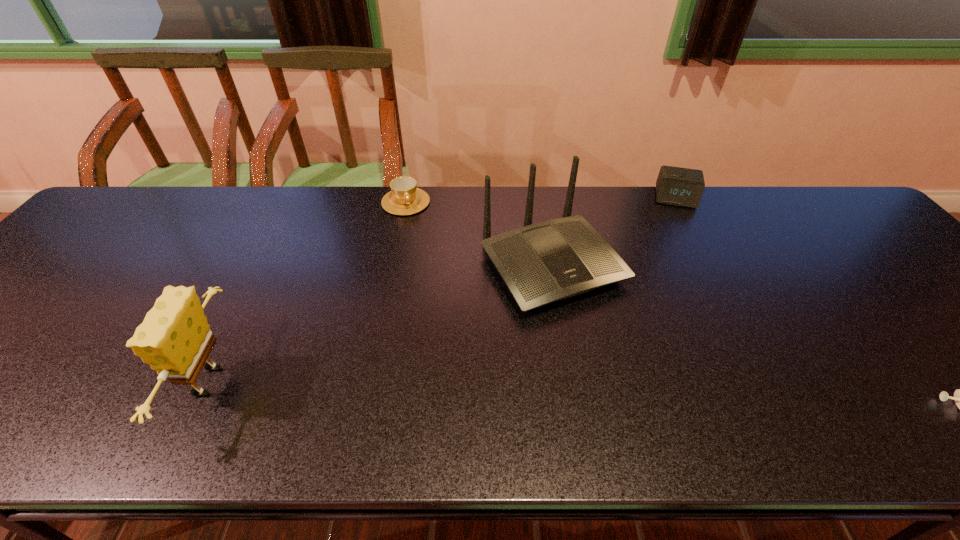
Locate an element on the screen. The height and width of the screenshot is (540, 960). free spot between the leftmost object and the router is located at coordinates (378, 323).

The width and height of the screenshot is (960, 540). In order to click on free area in between the cup and the fourth object from left to right in this screenshot , I will do `click(540, 200)`.

Find the location of a particular element. vacant point located between the sponge and the router is located at coordinates (378, 323).

You are a GUI agent. You are given a task and a screenshot of the screen. Output one action in this format:
    pyautogui.click(x=<x>, y=<y>)
    Task: Click on the vacant space that is in between the fourth object from left to right and the leftmost object
    
    Given the screenshot: What is the action you would take?
    pyautogui.click(x=440, y=290)

You are a GUI agent. You are given a task and a screenshot of the screen. Output one action in this format:
    pyautogui.click(x=<x>, y=<y>)
    Task: Click on the object that can be found as the second closest to the router
    The width and height of the screenshot is (960, 540).
    Given the screenshot: What is the action you would take?
    pyautogui.click(x=677, y=186)

Locate which object is the third closest to the leftmost object. Please provide its 2D coordinates. Your answer should be formatted as a tuple, i.e. [(x, y)], where the tuple contains the x and y coordinates of a point satisfying the conditions above.

[(677, 186)]